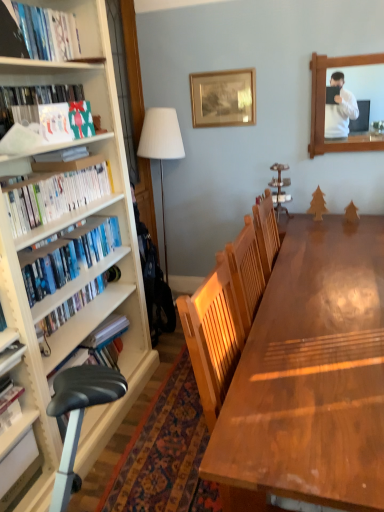
Where is `free location above wooden frame at upper right (from a real-world perspective)`? This screenshot has height=512, width=384. free location above wooden frame at upper right (from a real-world perspective) is located at coordinates (355, 45).